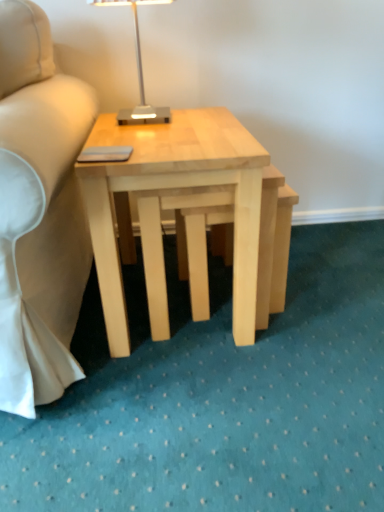
Question: Do you think natural wood step stool at center is within natural wood coffee table at center, or outside of it?

Choices:
 (A) inside
 (B) outside

Answer: (A)

Question: From a real-world perspective, is natural wood step stool at center above or below natural wood coffee table at center?

Choices:
 (A) above
 (B) below

Answer: (B)

Question: Which of these objects is positioned farthest from the natural wood coffee table at center?

Choices:
 (A) metallic silver table lamp at upper center
 (B) natural wood step stool at center

Answer: (A)

Question: Which object is positioned closest to the natural wood step stool at center?

Choices:
 (A) natural wood coffee table at center
 (B) metallic silver table lamp at upper center

Answer: (A)